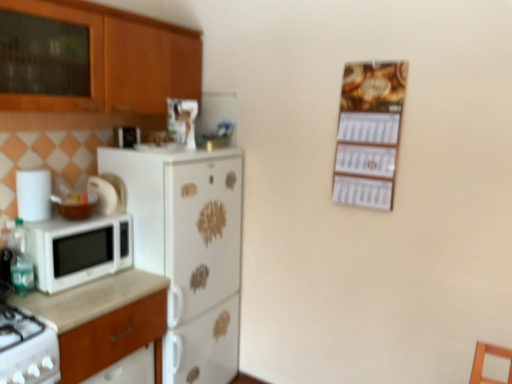
Find the location of a particular element. The width and height of the screenshot is (512, 384). free space above white laminate countertop at left (from a real-world perspective) is located at coordinates (99, 288).